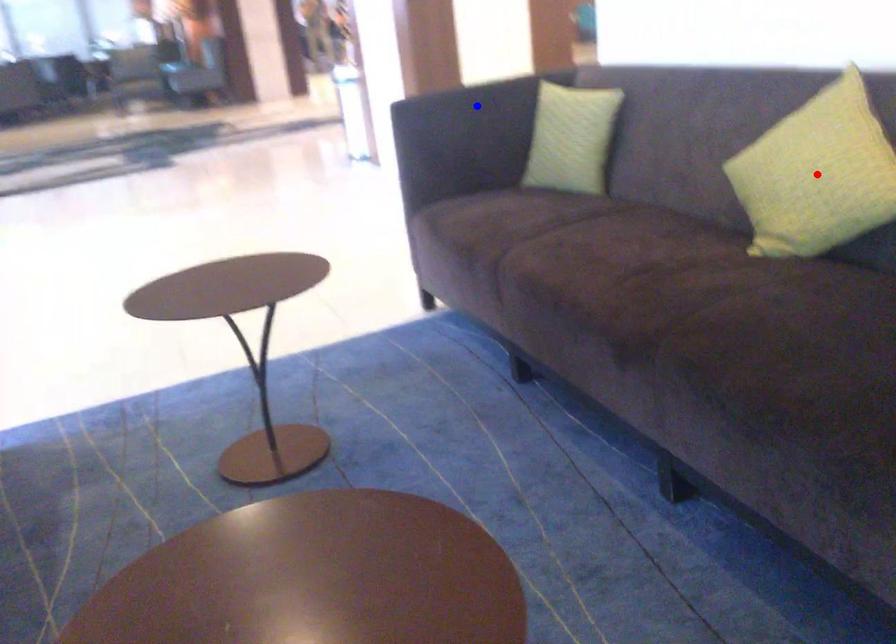
Question: Two points are marked on the image. Which point is closer to the camera?

Choices:
 (A) Blue point is closer.
 (B) Red point is closer.

Answer: (B)